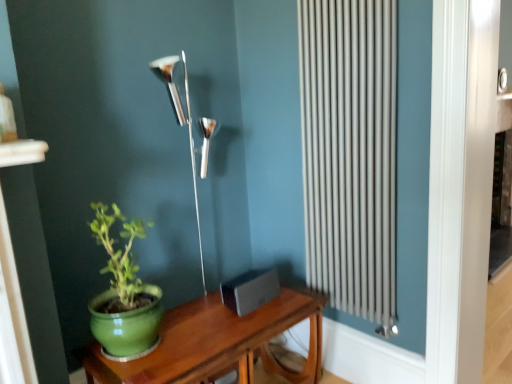
At what (x,y) coordinates should I click in order to perform the action: click on green wood table at lower left. Please return your answer as a coordinate pair (x, y). The image size is (512, 384). Looking at the image, I should click on (216, 343).

What do you see at coordinates (124, 294) in the screenshot?
I see `green matte pot at left` at bounding box center [124, 294].

Consider the image. In order to face silver metallic radiator at right, should I rotate leftwards or rightwards?

You should rotate right by 11.231 degrees.

The image size is (512, 384). What are the coordinates of `green wood table at lower left` in the screenshot? It's located at (216, 343).

In the image, is polished silver lamp at center positioned in front of or behind green wood table at lower left?

polished silver lamp at center is behind green wood table at lower left.

Between point (181, 109) and point (199, 373), which one is positioned behind?

The point (181, 109) is behind.

From a real-world perspective, is polished silver lamp at center physically located above or below green wood table at lower left?

From a real-world perspective, polished silver lamp at center is physically above green wood table at lower left.

Based on the photo, from a real-world perspective, which is physically below, silver metallic radiator at right or green wood table at lower left?

green wood table at lower left.

Is point (335, 84) positioned before point (179, 312)?

Yes, it is.

Is the position of silver metallic radiator at right more distant than that of green wood table at lower left?

That is True.

Can you see silver metallic radiator at right touching green wood table at lower left?

silver metallic radiator at right is not next to green wood table at lower left, and they're not touching.

Which object is closer to the camera taking this photo, green matte pot at left or green wood table at lower left?

Positioned in front is green wood table at lower left.

Is green matte pot at left wider than green wood table at lower left?

In fact, green matte pot at left might be narrower than green wood table at lower left.

Between green matte pot at left and green wood table at lower left, which one has more height?

With more height is green matte pot at left.

Based on their sizes in the image, would you say silver metallic radiator at right is bigger or smaller than polished silver lamp at center?

In the image, silver metallic radiator at right appears to be smaller than polished silver lamp at center.

From a real-world perspective, is silver metallic radiator at right positioned over polished silver lamp at center based on gravity?

Yes, from a real-world perspective, silver metallic radiator at right is above polished silver lamp at center.

Considering the positions of objects silver metallic radiator at right and polished silver lamp at center in the image provided, who is behind, silver metallic radiator at right or polished silver lamp at center?

polished silver lamp at center is further away from the camera.

Who is smaller, silver metallic radiator at right or green matte pot at left?

green matte pot at left is smaller.

Would you say silver metallic radiator at right is a long distance from green matte pot at left?

silver metallic radiator at right is actually quite close to green matte pot at left.

Looking at this image, from a real-world perspective, is silver metallic radiator at right above or below green matte pot at left?

silver metallic radiator at right is situated higher than green matte pot at left in the real world.

From the image's perspective, relative to green matte pot at left, is silver metallic radiator at right above or below?

silver metallic radiator at right is above green matte pot at left.

From a real-world perspective, is green matte pot at left positioned above or below polished silver lamp at center?

In terms of real-world spatial position, green matte pot at left is below polished silver lamp at center.

Who is shorter, green matte pot at left or polished silver lamp at center?

green matte pot at left.

Considering the sizes of objects green matte pot at left and polished silver lamp at center in the image provided, who is wider, green matte pot at left or polished silver lamp at center?

green matte pot at left is wider.

Would you say green matte pot at left is outside polished silver lamp at center?

Yes, green matte pot at left is located beyond the bounds of polished silver lamp at center.

Between green wood table at lower left and silver metallic radiator at right, which one has more height?

silver metallic radiator at right is taller.

From the image's perspective, does green wood table at lower left appear higher than silver metallic radiator at right?

No, from the image's perspective, green wood table at lower left is not on top of silver metallic radiator at right.

Between green wood table at lower left and silver metallic radiator at right, which one appears on the right side from the viewer's perspective?

silver metallic radiator at right.

From a real-world perspective, who is located higher, green wood table at lower left or silver metallic radiator at right?

silver metallic radiator at right, from a real-world perspective.

Locate an element on the screen. table to the right of polished silver lamp at center is located at coordinates (216, 343).

You are a GUI agent. You are given a task and a screenshot of the screen. Output one action in this format:
    pyautogui.click(x=<x>, y=<y>)
    Task: Click on the radiator above the green wood table at lower left (from a real-world perspective)
    The width and height of the screenshot is (512, 384).
    Given the screenshot: What is the action you would take?
    pyautogui.click(x=350, y=153)

Looking at the image, which one is located closer to green wood table at lower left, silver metallic radiator at right or polished silver lamp at center?

silver metallic radiator at right.

Looking at the image, which one is located further to green wood table at lower left, silver metallic radiator at right or green matte pot at left?

silver metallic radiator at right is further to green wood table at lower left.

When comparing their distances from green matte pot at left, does green wood table at lower left or polished silver lamp at center seem closer?

green wood table at lower left.

Looking at this image, which object lies further to the anchor point silver metallic radiator at right, green wood table at lower left or polished silver lamp at center?

The object further to silver metallic radiator at right is polished silver lamp at center.

From the image, which object appears to be farther from silver metallic radiator at right, green matte pot at left or polished silver lamp at center?

Based on the image, green matte pot at left appears to be further to silver metallic radiator at right.

Looking at the image, which one is located further to green wood table at lower left, polished silver lamp at center or green matte pot at left?

polished silver lamp at center lies further to green wood table at lower left than the other object.

Based on their spatial positions, is green matte pot at left or silver metallic radiator at right closer to green wood table at lower left?

Based on the image, green matte pot at left appears to be nearer to green wood table at lower left.

Looking at the image, which one is located further to silver metallic radiator at right, polished silver lamp at center or green wood table at lower left?

polished silver lamp at center lies further to silver metallic radiator at right than the other object.

Where is `houseplant between polished silver lamp at center and green wood table at lower left in the up-down direction`? houseplant between polished silver lamp at center and green wood table at lower left in the up-down direction is located at coordinates (124, 294).

Identify the location of table situated between green matte pot at left and silver metallic radiator at right from left to right. The height and width of the screenshot is (384, 512). (216, 343).

I want to click on lamp between green matte pot at left and silver metallic radiator at right from left to right, so click(x=186, y=125).

The width and height of the screenshot is (512, 384). Find the location of `lamp between silver metallic radiator at right and green wood table at lower left in the up-down direction`. lamp between silver metallic radiator at right and green wood table at lower left in the up-down direction is located at coordinates (186, 125).